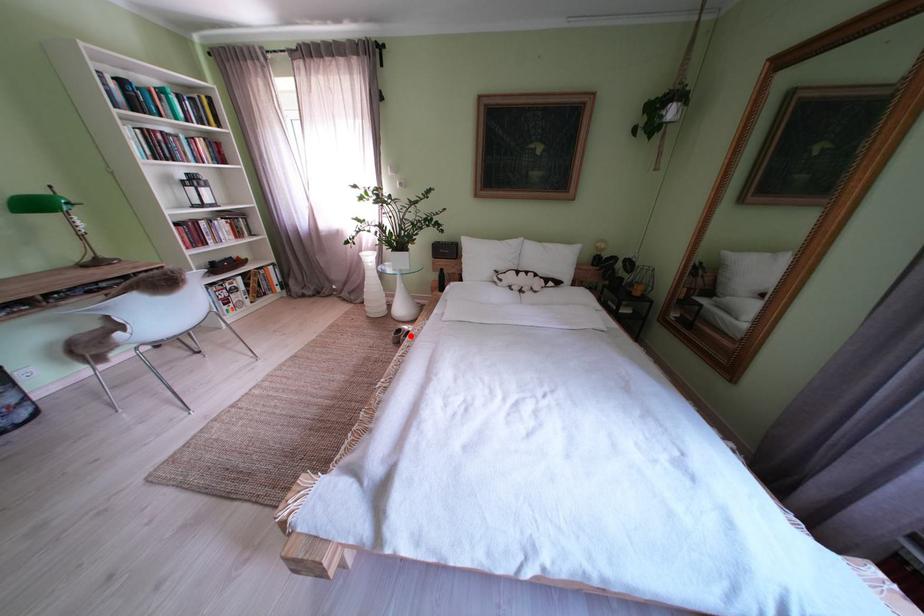
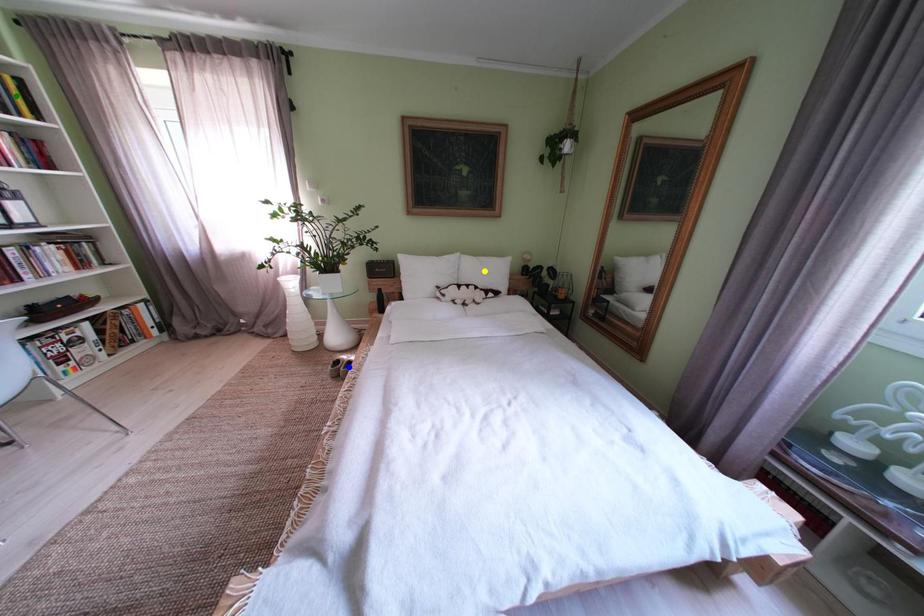
Question: I am providing you with two images of the same scene from different viewpoints. A red point is marked on the first image. You are given multiple points on the second image. Which mark in image 2 goes with the point in image 1?

Choices:
 (A) green point
 (B) yellow point
 (C) blue point

Answer: (C)